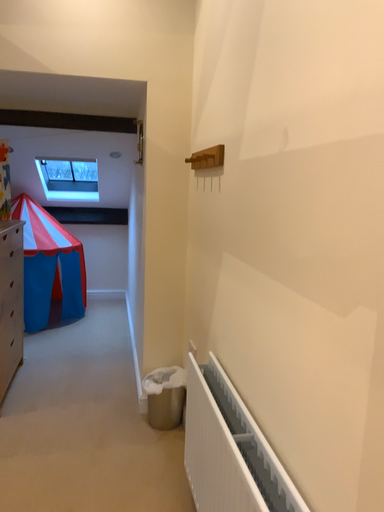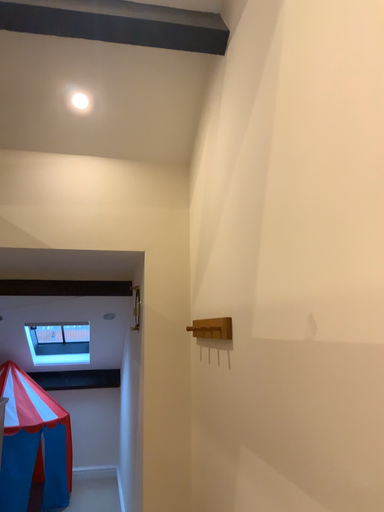
Question: Which way did the camera rotate in the video?

Choices:
 (A) rotated upward
 (B) rotated downward

Answer: (A)